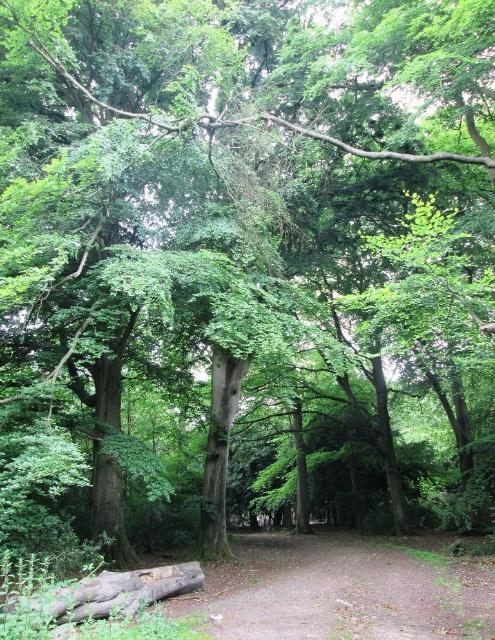
Does dirt/gravel path at center have a greater height compared to brown rough log at lower left?

Yes.

Between dirt/gravel path at center and brown rough log at lower left, which one appears on the left side from the viewer's perspective?

brown rough log at lower left is more to the left.

This screenshot has height=640, width=495. What do you see at coordinates (346, 589) in the screenshot?
I see `dirt/gravel path at center` at bounding box center [346, 589].

This screenshot has height=640, width=495. I want to click on dirt/gravel path at center, so tap(346, 589).